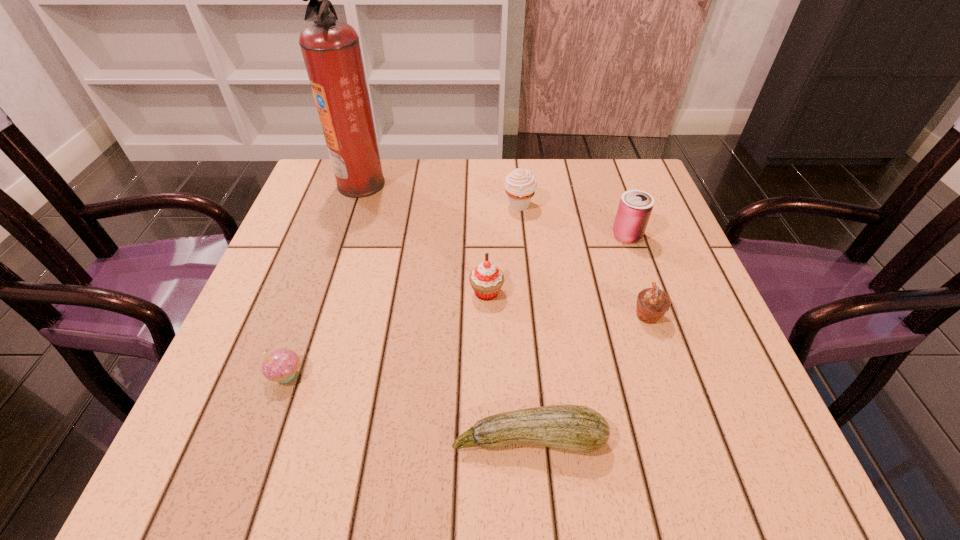
Locate an element on the screen. free region at the far right corner of the desktop is located at coordinates (593, 176).

Where is `free spot between the right cupcake and the can`? The image size is (960, 540). free spot between the right cupcake and the can is located at coordinates (557, 264).

Image resolution: width=960 pixels, height=540 pixels. I want to click on vacant region between the right muffin and the nearest object, so click(588, 377).

Locate an element on the screen. blank region between the tallest object and the farther cupcake is located at coordinates (424, 238).

This screenshot has height=540, width=960. Find the location of `empty space that is in between the right cupcake and the farther muffin`. empty space that is in between the right cupcake and the farther muffin is located at coordinates (503, 249).

At what (x,y) coordinates should I click in order to perform the action: click on free spot between the left muffin and the left cupcake. Please return your answer as a coordinate pair (x, y). Looking at the image, I should click on (403, 290).

In order to click on unoccupied area between the shorter muffin and the fifth nearest object in this screenshot , I will do `click(637, 276)`.

Find the location of a particular element. free spot between the fire extinguisher and the left muffin is located at coordinates (441, 194).

Where is `vacant area that lies between the right cupcake and the fire extinguisher`? Image resolution: width=960 pixels, height=540 pixels. vacant area that lies between the right cupcake and the fire extinguisher is located at coordinates (424, 238).

I want to click on vacant area that lies between the farther cupcake and the left muffin, so click(x=503, y=249).